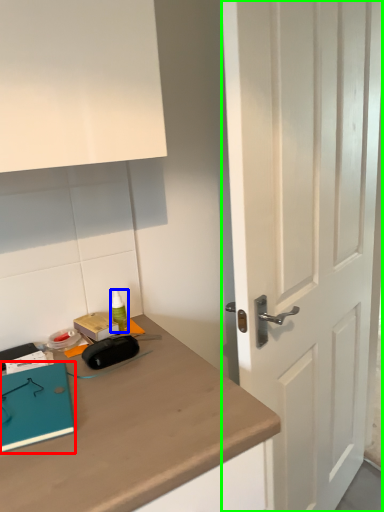
Question: Estimate the real-world distances between objects in this image. Which object is farther from notebook (highlighted by a red box), stationery (highlighted by a blue box) or door (highlighted by a green box)?

Choices:
 (A) stationery
 (B) door

Answer: (B)